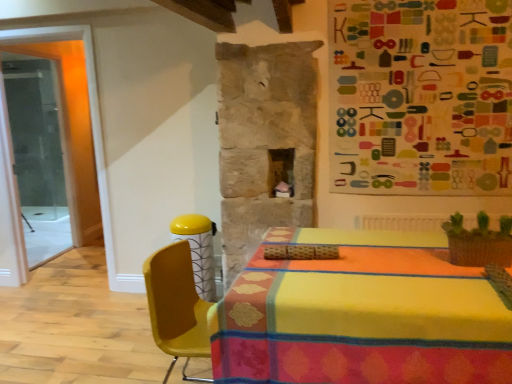
Question: Is yellow plastic chair at center inside or outside of transparent glass door at left?

Choices:
 (A) inside
 (B) outside

Answer: (B)

Question: In the image, is yellow plastic chair at center positioned in front of or behind transparent glass door at left?

Choices:
 (A) behind
 (B) front

Answer: (B)

Question: Estimate the real-world distances between objects in this image. Which object is closer to the yellow plastic chair at center?

Choices:
 (A) transparent glass door at left
 (B) multicolored fabric bulletin board at upper right

Answer: (B)

Question: Which of these objects is positioned closest to the transparent glass door at left?

Choices:
 (A) multicolored fabric bulletin board at upper right
 (B) yellow plastic chair at center

Answer: (B)